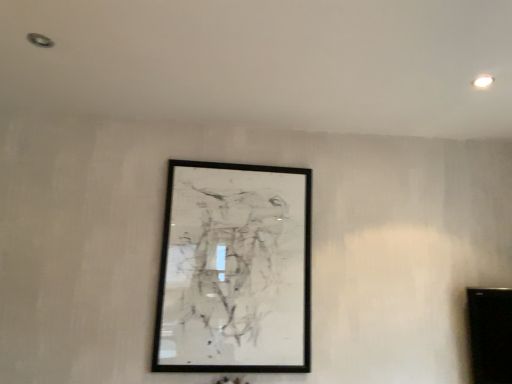
Describe the element at coordinates (234, 270) in the screenshot. Image resolution: width=512 pixels, height=384 pixels. I see `black matte picture frame at center` at that location.

What is the approximate height of black matte picture frame at center?

black matte picture frame at center is 99.57 centimeters in height.

You are a GUI agent. You are given a task and a screenshot of the screen. Output one action in this format:
    pyautogui.click(x=<x>, y=<y>)
    Task: Click on the black matte picture frame at center
    Image resolution: width=512 pixels, height=384 pixels.
    Given the screenshot: What is the action you would take?
    pyautogui.click(x=234, y=270)

Image resolution: width=512 pixels, height=384 pixels. I want to click on black matte picture frame at center, so click(x=234, y=270).